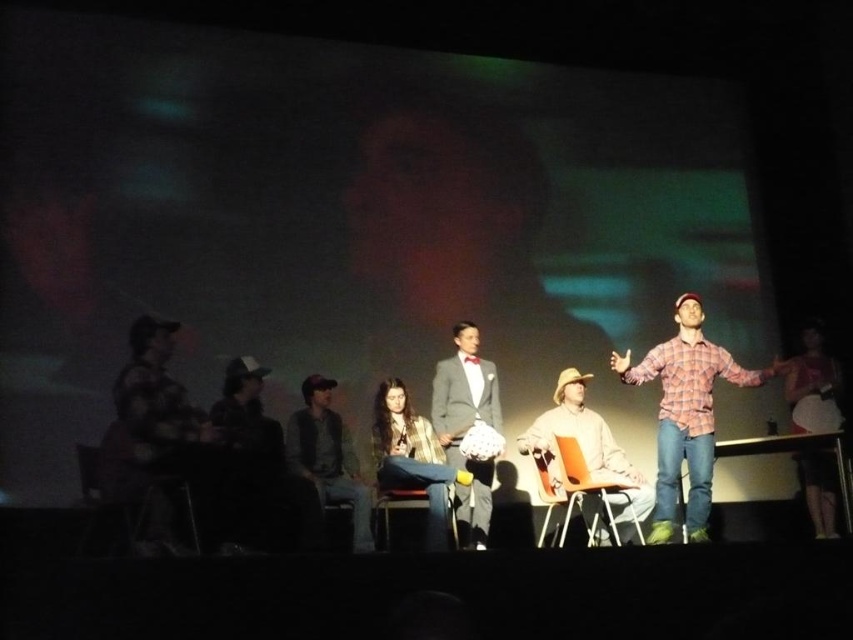
In the scene shown: You are a stage manager preparing to adjust the spotlight for the performer in the matte gray suit at center and the light brown leather hat at center. Which object should you focus the spotlight on first to ensure both are illuminated properly?

The matte gray suit at center should be focused on first since the light brown leather hat at center is positioned to its right side, allowing the spotlight to naturally encompass both when starting from the suit.

You are a stagehand preparing to adjust the spotlight for the performer in the matte gray suit at center. The spotlight is currently focused on the light brown leather hat at center. To move the spotlight to the correct performer, should you move the spotlight forward or backward?

The light brown leather hat at center is in front of the matte gray suit at center, so to move the spotlight to the matte gray suit at center, you should move the spotlight backward.